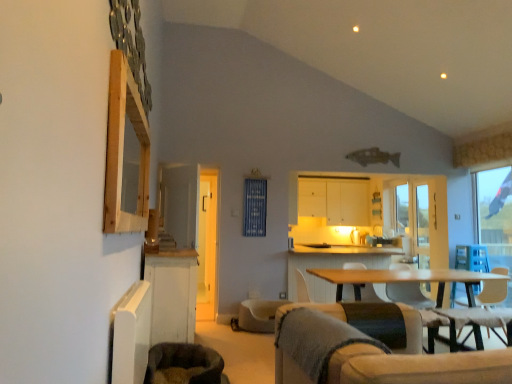
Question: Does white wood cabinet at lower left, positioned as the second cabinetry in top-to-bottom order, appear on the left side of dark brown plush swivel chair at lower left, acting as the 1th swivel chair starting from the front?

Choices:
 (A) no
 (B) yes

Answer: (B)

Question: Is white wood cabinet at lower left, positioned as the second cabinetry in top-to-bottom order, oriented away from dark brown plush swivel chair at lower left, the first swivel chair when ordered from left to right?

Choices:
 (A) yes
 (B) no

Answer: (B)

Question: From the image's perspective, is white wood cabinet at lower left, the first cabinetry positioned from the front, below dark brown plush swivel chair at lower left, the 2th swivel chair positioned from the back?

Choices:
 (A) yes
 (B) no

Answer: (B)

Question: Would you say white wood cabinet at lower left, the first cabinetry positioned from the front, is a long distance from dark brown plush swivel chair at lower left, the 2th swivel chair when ordered from right to left?

Choices:
 (A) yes
 (B) no

Answer: (B)

Question: Is white wood cabinet at lower left, positioned as the second cabinetry in top-to-bottom order, facing towards dark brown plush swivel chair at lower left, the 2th swivel chair positioned from the back?

Choices:
 (A) yes
 (B) no

Answer: (B)

Question: Would you say dark brown plush swivel chair at lower left, the 2th swivel chair when ordered from right to left, is part of white wood cabinet at lower left, positioned as the second cabinetry in top-to-bottom order,'s contents?

Choices:
 (A) yes
 (B) no

Answer: (B)

Question: Considering the relative sizes of white fabric armchair at center and beige fabric swivel chair at center, which appears as the 1th swivel chair when viewed from the back, in the image provided, is white fabric armchair at center wider than beige fabric swivel chair at center, which appears as the 1th swivel chair when viewed from the back,?

Choices:
 (A) no
 (B) yes

Answer: (A)

Question: Is white fabric armchair at center taller than beige fabric swivel chair at center, which appears as the 2th swivel chair when viewed from the front?

Choices:
 (A) no
 (B) yes

Answer: (B)

Question: Considering the relative positions of white fabric armchair at center and beige fabric swivel chair at center, which appears as the 1th swivel chair when viewed from the back, in the image provided, is white fabric armchair at center to the right of beige fabric swivel chair at center, which appears as the 1th swivel chair when viewed from the back, from the viewer's perspective?

Choices:
 (A) no
 (B) yes

Answer: (B)

Question: Is white fabric armchair at center aimed at beige fabric swivel chair at center, which is the 1th swivel chair in right-to-left order?

Choices:
 (A) no
 (B) yes

Answer: (A)

Question: Is white fabric armchair at center positioned far away from beige fabric swivel chair at center, which appears as the 1th swivel chair when viewed from the back?

Choices:
 (A) no
 (B) yes

Answer: (A)

Question: Is white fabric armchair at center looking in the opposite direction of beige fabric swivel chair at center, which appears as the 2th swivel chair when viewed from the front?

Choices:
 (A) no
 (B) yes

Answer: (A)

Question: Are white wood cabinet at lower left, positioned as the second cabinetry in top-to-bottom order, and light brown wooden table at center beside each other?

Choices:
 (A) no
 (B) yes

Answer: (A)